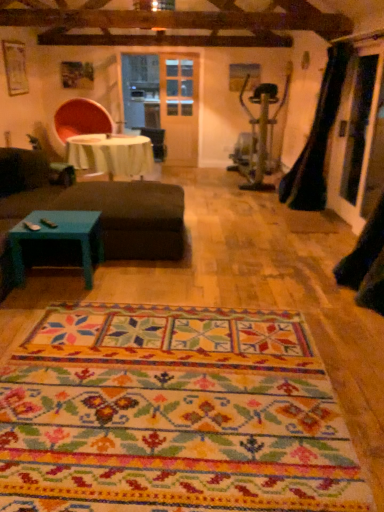
Measure the distance between multicolored woven mat at center and camera.

multicolored woven mat at center and camera are 1.56 meters apart from each other.

This screenshot has width=384, height=512. Describe the element at coordinates (111, 154) in the screenshot. I see `white fabric table at center` at that location.

What do you see at coordinates (99, 206) in the screenshot? I see `dark brown fabric ottoman at center` at bounding box center [99, 206].

At what (x,y) coordinates should I click in order to perform the action: click on multicolored woven mat at center. Please return your answer as a coordinate pair (x, y). Looking at the image, I should click on (172, 414).

Where is `curtain on the left of transparent glass door at right`? The width and height of the screenshot is (384, 512). curtain on the left of transparent glass door at right is located at coordinates (317, 138).

Would you consider transparent glass door at right to be distant from black leather guitar case at right?

No, there isn't a large distance between transparent glass door at right and black leather guitar case at right.

Does point (361, 55) appear closer or farther from the camera than point (308, 169)?

Point (361, 55) appears to be closer to the viewer than point (308, 169).

What's the angular difference between teal painted wood coffee table at lower left and white fabric table at center's facing directions?

There is a 0.000388-degree angle between the facing directions of teal painted wood coffee table at lower left and white fabric table at center.

Does teal painted wood coffee table at lower left appear on the right side of white fabric table at center?

Correct, you'll find teal painted wood coffee table at lower left to the right of white fabric table at center.

From the image's perspective, between teal painted wood coffee table at lower left and white fabric table at center, who is located below?

teal painted wood coffee table at lower left appears lower in the image.

Is there a large distance between black leather guitar case at right and dark brown fabric ottoman at center?

Yes, black leather guitar case at right and dark brown fabric ottoman at center are quite far apart.

Is black leather guitar case at right at the left side of dark brown fabric ottoman at center?

No.

From a real-world perspective, is black leather guitar case at right positioned under dark brown fabric ottoman at center based on gravity?

No, from a real-world perspective, black leather guitar case at right is not beneath dark brown fabric ottoman at center.

This screenshot has height=512, width=384. I want to click on curtain on the right of multicolored woven mat at center, so click(x=317, y=138).

How many degrees apart are the facing directions of black leather guitar case at right and multicolored woven mat at center?

black leather guitar case at right and multicolored woven mat at center are facing 93.9 degrees away from each other.

Considering the sizes of objects black leather guitar case at right and multicolored woven mat at center in the image provided, who is thinner, black leather guitar case at right or multicolored woven mat at center?

Thinner between the two is black leather guitar case at right.

Is black leather guitar case at right taller or shorter than multicolored woven mat at center?

Considering their sizes, black leather guitar case at right has more height than multicolored woven mat at center.

From a real-world perspective, is transparent glass door at right positioned above or below dark brown fabric ottoman at center?

From a real-world perspective, transparent glass door at right is physically above dark brown fabric ottoman at center.

Is transparent glass door at right thinner than dark brown fabric ottoman at center?

Correct, the width of transparent glass door at right is less than that of dark brown fabric ottoman at center.

Looking at this image, between transparent glass door at right and dark brown fabric ottoman at center, which one has less height?

dark brown fabric ottoman at center.

From the image's perspective, is transparent glass door at right positioned above or below dark brown fabric ottoman at center?

Clearly, from the image's perspective, transparent glass door at right is above dark brown fabric ottoman at center.

From a real-world perspective, is white fabric table at center on top of black leather guitar case at right?

No, from a real-world perspective, white fabric table at center is not above black leather guitar case at right.

Between white fabric table at center and black leather guitar case at right, which one has smaller size?

black leather guitar case at right.

Can black leather guitar case at right be found inside white fabric table at center?

No.

Which object is more forward, dark brown fabric ottoman at center or multicolored woven mat at center?

multicolored woven mat at center is in front.

Would you say dark brown fabric ottoman at center is inside or outside multicolored woven mat at center?

dark brown fabric ottoman at center is spatially situated outside multicolored woven mat at center.

Would you say dark brown fabric ottoman at center is to the left or to the right of multicolored woven mat at center in the picture?

dark brown fabric ottoman at center is to the left of multicolored woven mat at center.

Image resolution: width=384 pixels, height=512 pixels. I want to click on mat in front of the dark brown fabric ottoman at center, so click(x=172, y=414).

The height and width of the screenshot is (512, 384). I want to click on glass door in front of the black leather guitar case at right, so click(356, 135).

This screenshot has height=512, width=384. Identify the location of coffee table below the white fabric table at center (from a real-world perspective). (59, 238).

Estimate the real-world distances between objects in this image. Which object is further from dark brown fabric ottoman at center, black leather guitar case at right or transparent glass door at right?

black leather guitar case at right is positioned further to the anchor dark brown fabric ottoman at center.

When comparing their distances from dark brown fabric ottoman at center, does white fabric table at center or teal painted wood coffee table at lower left seem closer?

teal painted wood coffee table at lower left lies closer to dark brown fabric ottoman at center than the other object.

When comparing their distances from dark brown fabric ottoman at center, does multicolored woven mat at center or transparent glass door at right seem further?

transparent glass door at right is further to dark brown fabric ottoman at center.

Based on the photo, when comparing their distances from teal painted wood coffee table at lower left, does multicolored woven mat at center or transparent glass door at right seem further?

transparent glass door at right lies further to teal painted wood coffee table at lower left than the other object.

Looking at the image, which one is located further to multicolored woven mat at center, white fabric table at center or dark brown fabric ottoman at center?

white fabric table at center lies further to multicolored woven mat at center than the other object.

In the scene shown: Estimate the real-world distances between objects in this image. Which object is closer to multicolored woven mat at center, transparent glass door at right or teal painted wood coffee table at lower left?

teal painted wood coffee table at lower left lies closer to multicolored woven mat at center than the other object.

Looking at the image, which one is located closer to white fabric table at center, teal painted wood coffee table at lower left or dark brown fabric ottoman at center?

The object closer to white fabric table at center is dark brown fabric ottoman at center.

Looking at this image, which object lies nearer to the anchor point black leather guitar case at right, white fabric table at center or multicolored woven mat at center?

white fabric table at center is positioned closer to the anchor black leather guitar case at right.

You are a GUI agent. You are given a task and a screenshot of the screen. Output one action in this format:
    pyautogui.click(x=<x>, y=<y>)
    Task: Click on the coffee table situated between white fabric table at center and transparent glass door at right from left to right
    This screenshot has width=384, height=512.
    Given the screenshot: What is the action you would take?
    pyautogui.click(x=59, y=238)

Where is `coffee table between multicolored woven mat at center and white fabric table at center along the z-axis`? coffee table between multicolored woven mat at center and white fabric table at center along the z-axis is located at coordinates (59, 238).

This screenshot has width=384, height=512. In order to click on curtain between multicolored woven mat at center and white fabric table at center in the front-back direction in this screenshot , I will do `click(317, 138)`.

Where is `mat situated between teal painted wood coffee table at lower left and transparent glass door at right from left to right`? mat situated between teal painted wood coffee table at lower left and transparent glass door at right from left to right is located at coordinates (172, 414).